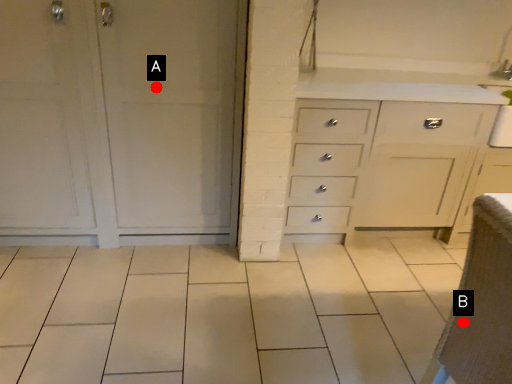
Question: Two points are circled on the image, labeled by A and B beside each circle. Which point is closer to the camera?

Choices:
 (A) A is closer
 (B) B is closer

Answer: (B)